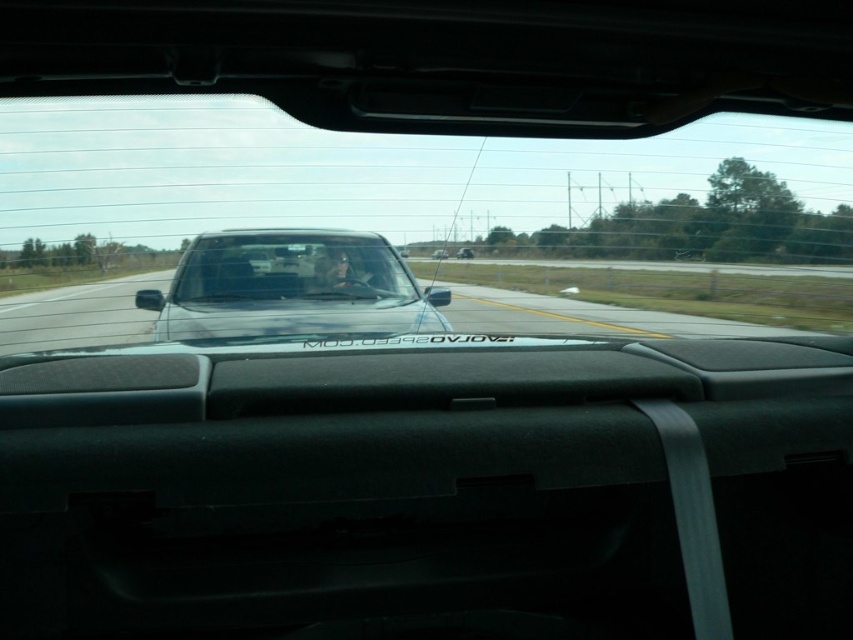
Question: Is black glossy car at center below satin black truck at center?

Choices:
 (A) no
 (B) yes

Answer: (A)

Question: Does transparent glass car window at center appear under clear glass windshield at center?

Choices:
 (A) no
 (B) yes

Answer: (A)

Question: Estimate the real-world distances between objects in this image. Which object is farther from the transparent glass car window at center?

Choices:
 (A) satin black truck at center
 (B) clear glass windshield at center

Answer: (A)

Question: Can you confirm if transparent glass car window at center is bigger than black glossy car at center?

Choices:
 (A) yes
 (B) no

Answer: (A)

Question: Which of these objects is positioned farthest from the black glossy car at center?

Choices:
 (A) satin black truck at center
 (B) clear glass windshield at center
 (C) transparent glass car window at center

Answer: (A)

Question: Which point is farther from the camera taking this photo?

Choices:
 (A) (374, 275)
 (B) (267, 262)
 (C) (740, 307)
 (D) (234, 333)

Answer: (C)